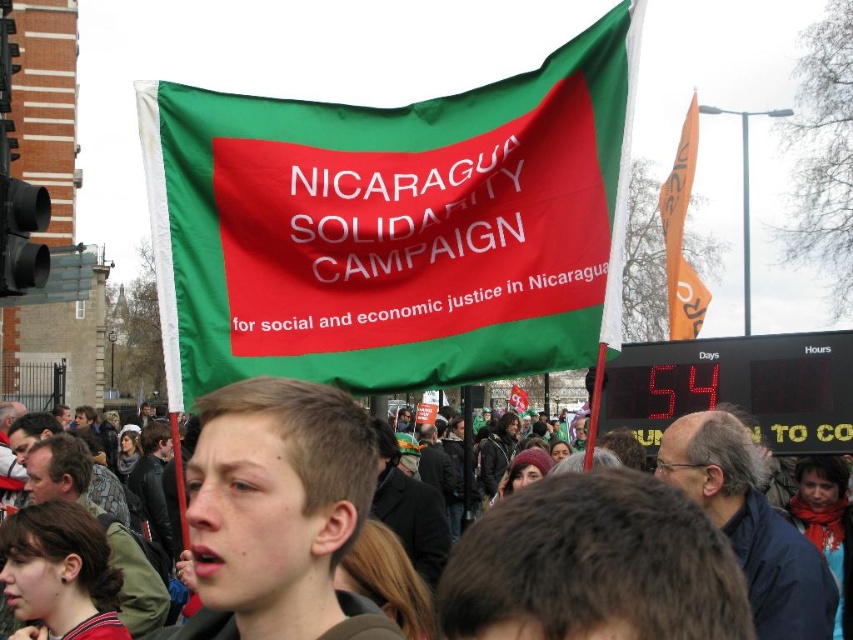
Based on the coordinates provided, what object is located at point (393,227) in the image?

The point (393,227) indicates the location of the green fabric flag at center.

Looking at the protest scene, where is the smooth brown hair at center in relation to the orange fabric flag at upper right?

The smooth brown hair at center is to the left of the orange fabric flag at upper right.

Based on the scene description, can you determine which object is wider between the smooth brown hair at center and the orange fabric flag at upper right?

The smooth brown hair at center is wider than the orange fabric flag at upper right according to the description.